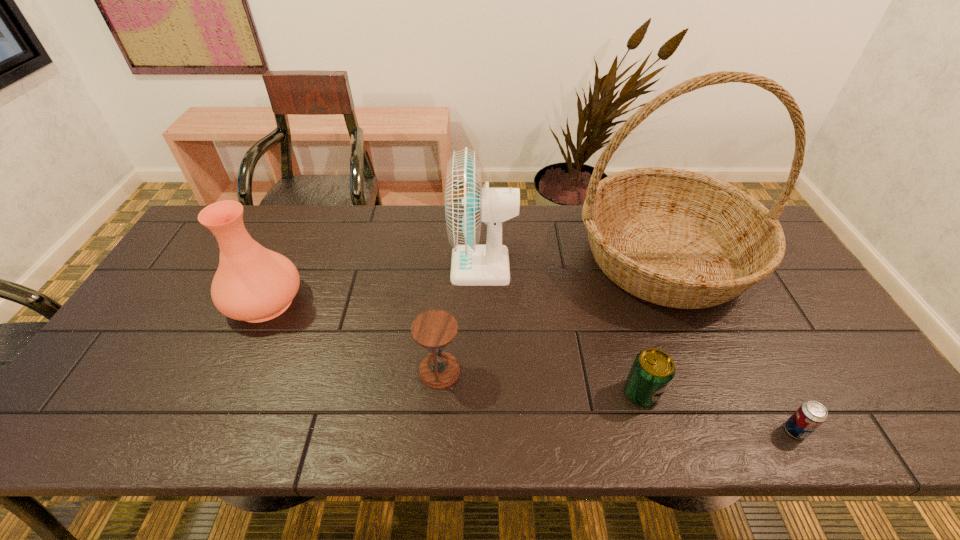
Identify the location of object present at the far right corner. This screenshot has height=540, width=960. (676, 238).

Identify the location of vacant space at the far edge of the desktop. 314,214.

In the image, there is a desktop. Find the location of `free region at the near edge`. free region at the near edge is located at coordinates (604, 407).

You are a GUI agent. You are given a task and a screenshot of the screen. Output one action in this format:
    pyautogui.click(x=<x>, y=<y>)
    Task: Click on the vacant point at the left edge
    The height and width of the screenshot is (540, 960).
    Given the screenshot: What is the action you would take?
    pyautogui.click(x=106, y=369)

Identify the location of free space at the right edge of the desktop. (824, 362).

This screenshot has height=540, width=960. Identify the location of free space between the left beer can and the fourth tallest object. (540, 382).

This screenshot has width=960, height=540. Find the location of `free space between the shortest object and the basket`. free space between the shortest object and the basket is located at coordinates (730, 345).

Where is `vacant region between the hourglass and the tallest object`? vacant region between the hourglass and the tallest object is located at coordinates (552, 314).

Where is `empty space between the taller beer can and the basket`? The width and height of the screenshot is (960, 540). empty space between the taller beer can and the basket is located at coordinates tap(653, 326).

Find the location of a particular element. free area in between the shortest object and the fourth tallest object is located at coordinates (617, 401).